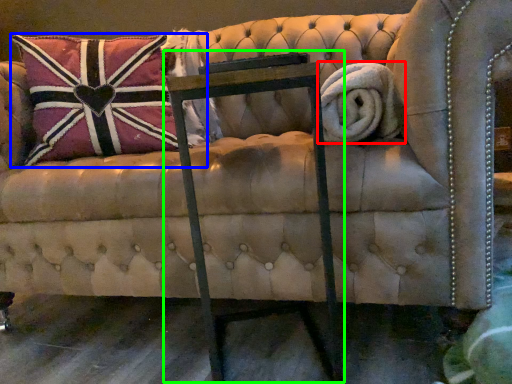
Question: Which object is positioned farthest from bath towel (highlighted by a red box)? Select from pillow (highlighted by a blue box) and rocking chair (highlighted by a green box).

Choices:
 (A) pillow
 (B) rocking chair

Answer: (A)